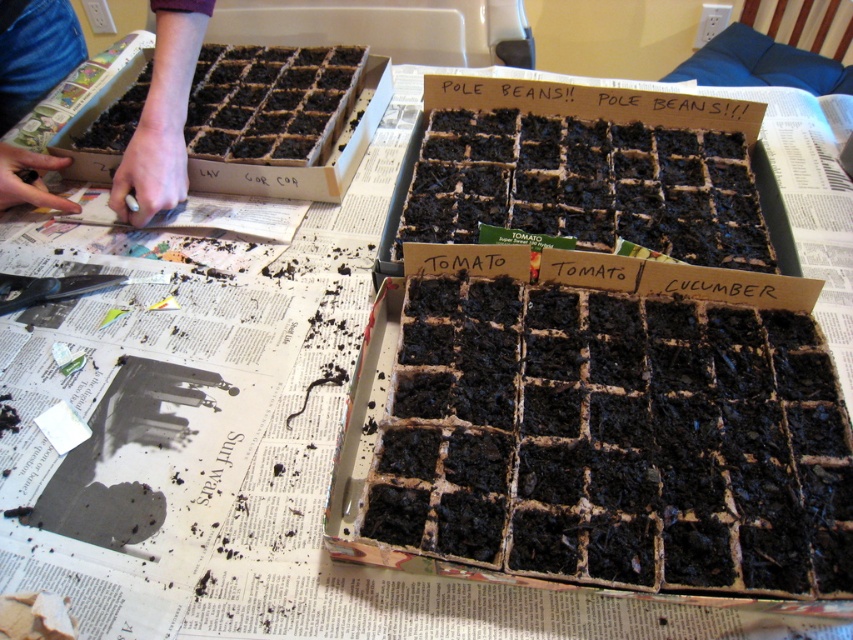
You are a gardener who just arrived at the table with the newspaper. You need to place a new seedling tray between the smooth skin hand at upper left and the brown cardboard box at upper left. Is there enough space between them to fit the tray?

The smooth skin hand at upper left is positioned on the left side of brown cardboard box at upper left, but the exact distance between them isn

Looking at this image, you are a gardener who just arrived at the table with the newspaper. You see the smooth skin hand at upper left and the brown cardboard box at upper left. Which object is closer to you?

The smooth skin hand at upper left is closer to you because it is positioned under the brown cardboard box at upper left, meaning the hand is in front of the box.

You are a gardener who wants to reach for the seedling tray on the right labeled with POLE BEANS!! and POLE BEANS!!!. You are currently holding a watering can in your right hand and your smooth skin hand at upper left is free. Given that the tray is 29.99 inches away from you, can you safely reach it with your free hand?

The smooth skin hand at upper left is 29.99 inches away from the viewer, so yes, you can safely reach the seedling tray on the right labeled with POLE BEANS!! and POLE BEANS!!! with your free hand since the distance is within a typical comfortable reaching range.